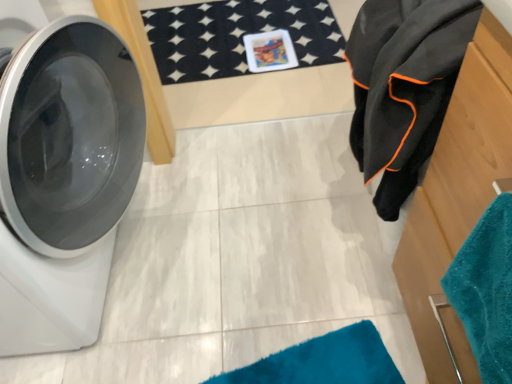
Question: Considering the relative sizes of wooden dresser at right and black fleece towel at right in the image provided, is wooden dresser at right thinner than black fleece towel at right?

Choices:
 (A) no
 (B) yes

Answer: (B)

Question: Does wooden dresser at right have a greater width compared to black fleece towel at right?

Choices:
 (A) yes
 (B) no

Answer: (B)

Question: Is wooden dresser at right positioned before black fleece towel at right?

Choices:
 (A) yes
 (B) no

Answer: (A)

Question: Is black fleece towel at right at the back of wooden dresser at right?

Choices:
 (A) no
 (B) yes

Answer: (A)

Question: From a real-world perspective, is wooden dresser at right physically above black fleece towel at right?

Choices:
 (A) yes
 (B) no

Answer: (B)

Question: From the image's perspective, relative to wooden dresser at right, is white glossy washing machine at left above or below?

Choices:
 (A) below
 (B) above

Answer: (B)

Question: Considering the positions of point (58, 203) and point (509, 173), is point (58, 203) closer or farther from the camera than point (509, 173)?

Choices:
 (A) farther
 (B) closer

Answer: (A)

Question: Relative to wooden dresser at right, is white glossy washing machine at left in front or behind?

Choices:
 (A) behind
 (B) front

Answer: (A)

Question: Which is correct: white glossy washing machine at left is inside wooden dresser at right, or outside of it?

Choices:
 (A) inside
 (B) outside

Answer: (B)

Question: In terms of width, does teal soft towel at right look wider or thinner when compared to wooden dresser at right?

Choices:
 (A) thin
 (B) wide

Answer: (A)

Question: Is point (483, 302) positioned closer to the camera than point (503, 150)?

Choices:
 (A) farther
 (B) closer

Answer: (A)

Question: Is teal soft towel at right situated inside wooden dresser at right or outside?

Choices:
 (A) inside
 (B) outside

Answer: (B)

Question: Relative to wooden dresser at right, is teal soft towel at right in front or behind?

Choices:
 (A) behind
 (B) front

Answer: (B)

Question: Is wooden dresser at right bigger or smaller than white glossy washing machine at left?

Choices:
 (A) small
 (B) big

Answer: (A)

Question: Looking at their shapes, would you say wooden dresser at right is wider or thinner than white glossy washing machine at left?

Choices:
 (A) wide
 (B) thin

Answer: (B)